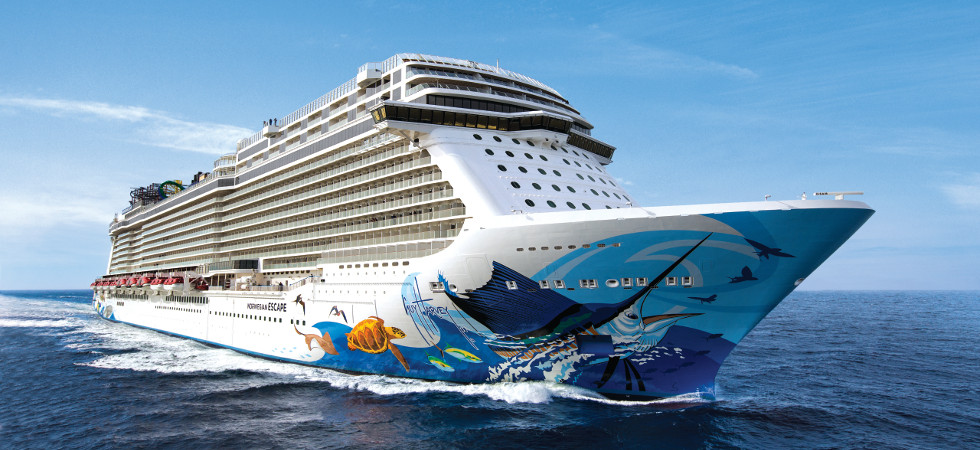
This screenshot has height=450, width=980. What are the coordinates of `various doors` in the screenshot? It's located at (406, 184), (376, 177), (349, 200), (345, 218), (268, 194), (238, 208).